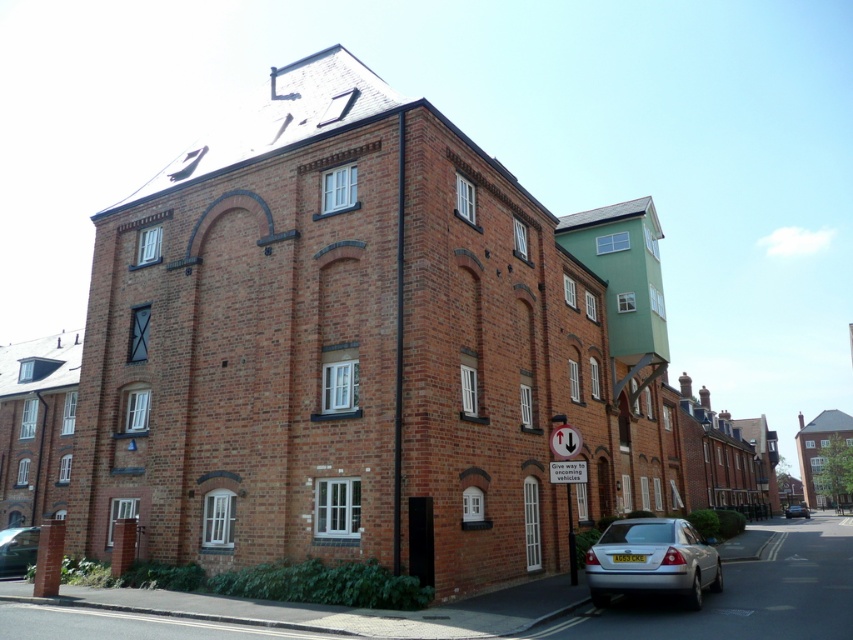
You are standing at the entrance of the building and want to check if the silver metallic sedan at lower right is within a 40 feet safety zone. Can you confirm if it is within the zone?

The silver metallic sedan at lower right is 35.48 feet away from the camera, so it is within the 40 feet safety zone.

You are a delivery person trying to park your van between the silver metallic sedan at lower right and the metallic silver car at lower left. Can you fit your van, which is 2 meters wide, in the space between them?

The silver metallic sedan at lower right is thinner than the metallic silver car at lower left, but the exact width of the space between them isn not provided. Without knowing the distance between the two cars, it is impossible to determine if the van can fit.

You are a delivery person needing to park your van between the silver metallic sedan at lower right and the metallic silver car at lower left. Your van is 20 feet long. Can you fit your van between them without moving either car?

The silver metallic sedan at lower right is 54.99 feet away from the metallic silver car at lower left. Since your van is 20 feet long, there is sufficient space between them to park your van without moving either car.